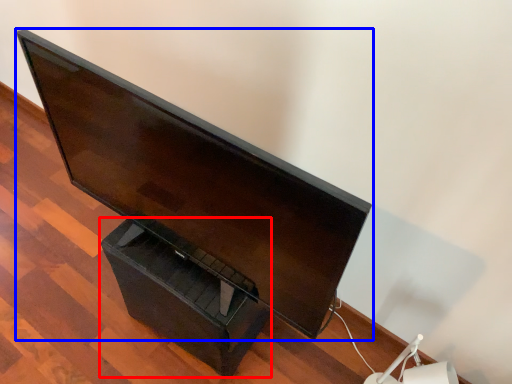
Question: Among these objects, which one is farthest to the camera, drawer (highlighted by a red box) or computer monitor (highlighted by a blue box)?

Choices:
 (A) drawer
 (B) computer monitor

Answer: (A)